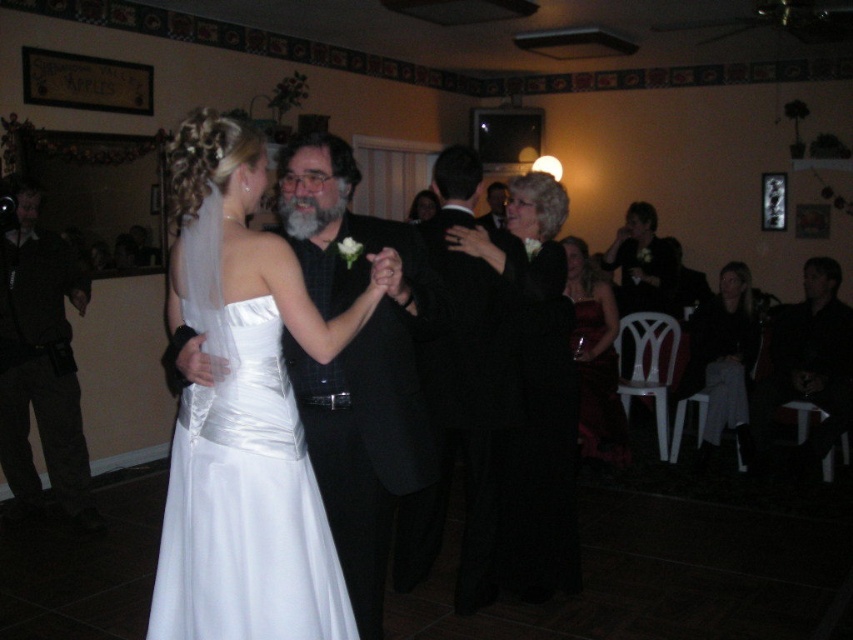
You are a photographer at the wedding reception. You need to capture a photo that includes both the black textured suit at center and the dark brown leather pants at left. Which one should you focus on first to ensure they both fit in the frame?

The black textured suit at center is larger in size compared to the dark brown leather pants at left, so you should focus on the black textured suit at center first to ensure both fit in the frame.

You are a photographer standing at the back of the reception hall. You want to capture a photo that includes both the black textured suit at center and the dark brown leather pants at left. The camera you are using has a maximum focus range of 6 feet. Will you be able to capture both subjects in focus without moving closer?

The distance between the black textured suit at center and the dark brown leather pants at left is 7.18 feet. Since the camera can only focus within 6 feet, the subjects are too far apart to be captured in focus simultaneously. You will need to move closer to reduce the distance between them or adjust your camera settings.